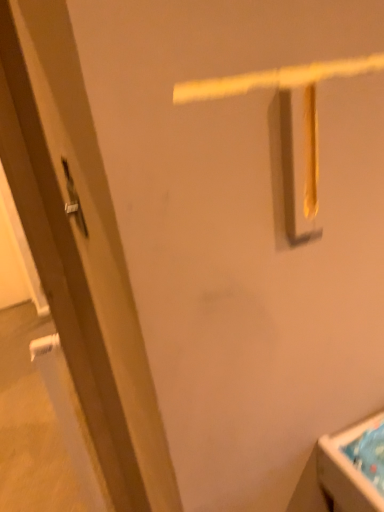
Question: Is matte brown door at left positioned behind white glossy sink at lower right?

Choices:
 (A) yes
 (B) no

Answer: (B)

Question: Is matte brown door at left aimed at white glossy sink at lower right?

Choices:
 (A) yes
 (B) no

Answer: (B)

Question: Can you confirm if matte brown door at left is bigger than white glossy sink at lower right?

Choices:
 (A) no
 (B) yes

Answer: (B)

Question: Is white glossy sink at lower right at the back of matte brown door at left?

Choices:
 (A) no
 (B) yes

Answer: (B)

Question: From a real-world perspective, is matte brown door at left located beneath white glossy sink at lower right?

Choices:
 (A) yes
 (B) no

Answer: (B)

Question: Is matte brown door at left closer to camera compared to white glossy sink at lower right?

Choices:
 (A) yes
 (B) no

Answer: (A)

Question: Is white glossy sink at lower right taller than matte brown door at left?

Choices:
 (A) yes
 (B) no

Answer: (B)

Question: Is white glossy sink at lower right oriented towards matte brown door at left?

Choices:
 (A) no
 (B) yes

Answer: (A)

Question: Considering the relative positions of white glossy sink at lower right and matte brown door at left in the image provided, is white glossy sink at lower right to the right of matte brown door at left from the viewer's perspective?

Choices:
 (A) no
 (B) yes

Answer: (B)

Question: Considering the relative positions of white glossy sink at lower right and matte brown door at left in the image provided, is white glossy sink at lower right to the left of matte brown door at left from the viewer's perspective?

Choices:
 (A) no
 (B) yes

Answer: (A)

Question: Is white glossy sink at lower right outside matte brown door at left?

Choices:
 (A) no
 (B) yes

Answer: (B)

Question: Is white glossy sink at lower right facing away from matte brown door at left?

Choices:
 (A) no
 (B) yes

Answer: (A)

Question: Is white glossy sink at lower right at the back of satin silver door handle at left?

Choices:
 (A) no
 (B) yes

Answer: (A)